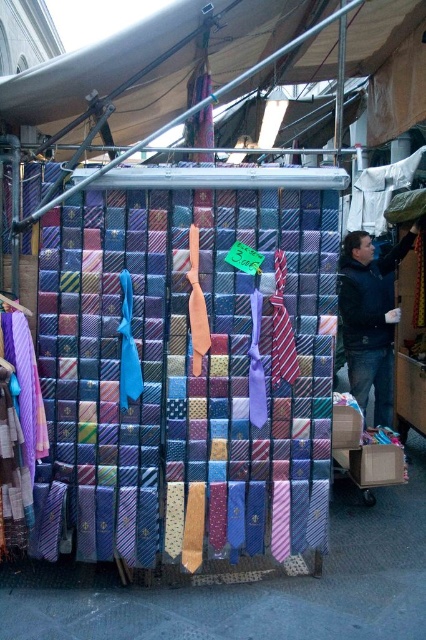
Is point (69, 90) closer to camera compared to point (22, 305)?

Yes, point (69, 90) is in front of point (22, 305).

Between beige fabric canopy at upper center and matte purple tie at left, which one has more height?

beige fabric canopy at upper center is taller.

Is point (270, 17) positioned in front of point (2, 292)?

That is False.

What are the coordinates of `beige fabric canopy at upper center` in the screenshot? It's located at (92, 68).

Is beige fabric canopy at upper center bigger than dark blue jacket at center?

Indeed, beige fabric canopy at upper center has a larger size compared to dark blue jacket at center.

Is beige fabric canopy at upper center above dark blue jacket at center?

Indeed, beige fabric canopy at upper center is positioned over dark blue jacket at center.

Does point (160, 12) lie behind point (354, 260)?

No, it is in front of (354, 260).

Find the location of `beige fabric canopy at upper center`. beige fabric canopy at upper center is located at coordinates (92, 68).

Is the position of dark blue jacket at center less distant than that of matte purple tie at left?

That is False.

From the picture: Which of these two, dark blue jacket at center or matte purple tie at left, stands taller?

dark blue jacket at center

Image resolution: width=426 pixels, height=640 pixels. Describe the element at coordinates (370, 317) in the screenshot. I see `dark blue jacket at center` at that location.

This screenshot has height=640, width=426. I want to click on dark blue jacket at center, so click(370, 317).